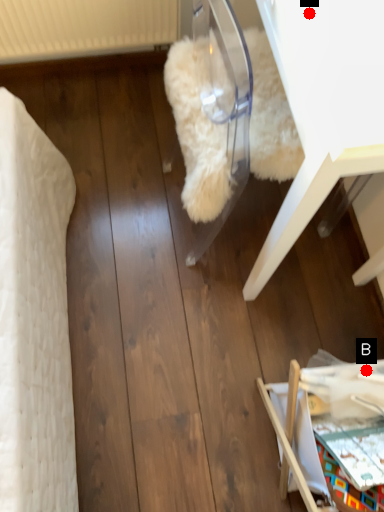
Question: Two points are circled on the image, labeled by A and B beside each circle. Which point is closer to the camera?

Choices:
 (A) A is closer
 (B) B is closer

Answer: (A)